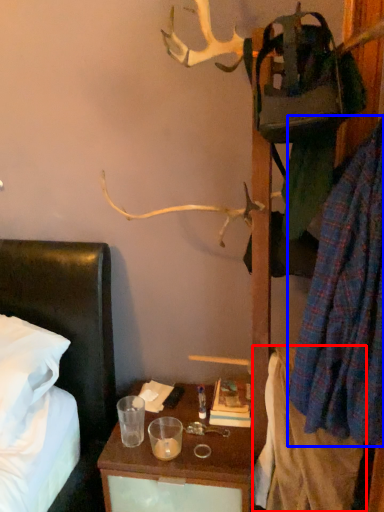
Question: Among these objects, which one is farthest to the camera, clothing (highlighted by a red box) or clothing (highlighted by a blue box)?

Choices:
 (A) clothing
 (B) clothing

Answer: (A)